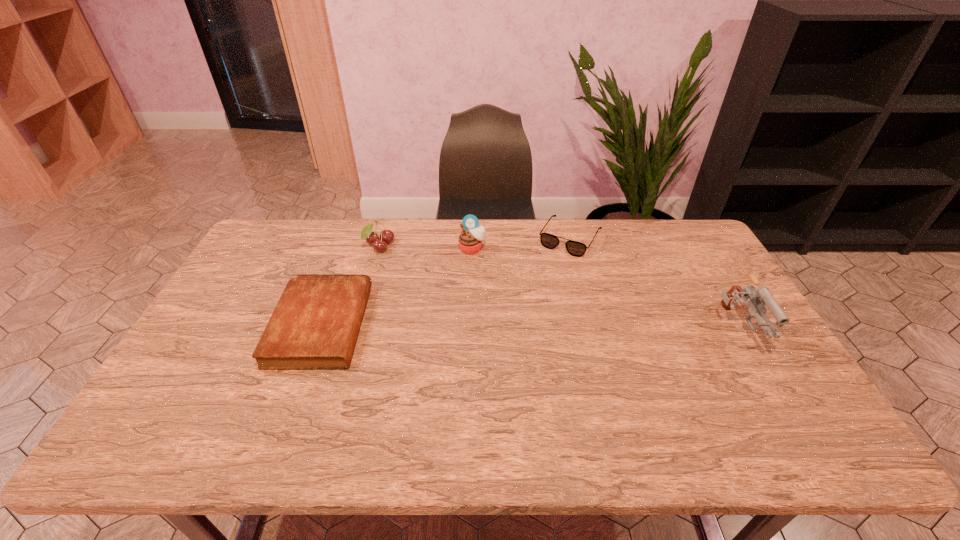
Find the location of `vacant position located 0.190m on the front-facing side of the third object from right to left`. vacant position located 0.190m on the front-facing side of the third object from right to left is located at coordinates pyautogui.click(x=468, y=294).

Find the location of a particular element. free space located on the front-facing side of the third object from right to left is located at coordinates (467, 318).

This screenshot has height=540, width=960. Find the location of `free point located on the front-facing side of the spectacles`. free point located on the front-facing side of the spectacles is located at coordinates (523, 314).

Find the location of `free region located on the front-facing side of the spectacles`. free region located on the front-facing side of the spectacles is located at coordinates (551, 269).

This screenshot has width=960, height=540. In order to click on vacant region located on the front-facing side of the spectacles in this screenshot , I will do `click(521, 319)`.

The width and height of the screenshot is (960, 540). I want to click on free space located on the leaves of the cherry, so click(x=431, y=288).

You are a GUI agent. You are given a task and a screenshot of the screen. Output one action in this format:
    pyautogui.click(x=<x>, y=<y>)
    Task: Click on the vacant space located on the leaves of the cherry
    Image resolution: width=960 pixels, height=540 pixels.
    Given the screenshot: What is the action you would take?
    pyautogui.click(x=455, y=308)

You are a GUI agent. You are given a task and a screenshot of the screen. Output one action in this format:
    pyautogui.click(x=<x>, y=<y>)
    Task: Click on the vacant point located on the leaves of the cherry
    The image size is (960, 540).
    Given the screenshot: What is the action you would take?
    point(412,272)

At what (x,y) coordinates should I click in order to perform the action: click on muffin at the far edge. Please return your answer as a coordinate pair (x, y). Looking at the image, I should click on (470, 240).

This screenshot has height=540, width=960. Identify the location of spectacles located at the far edge. (574, 248).